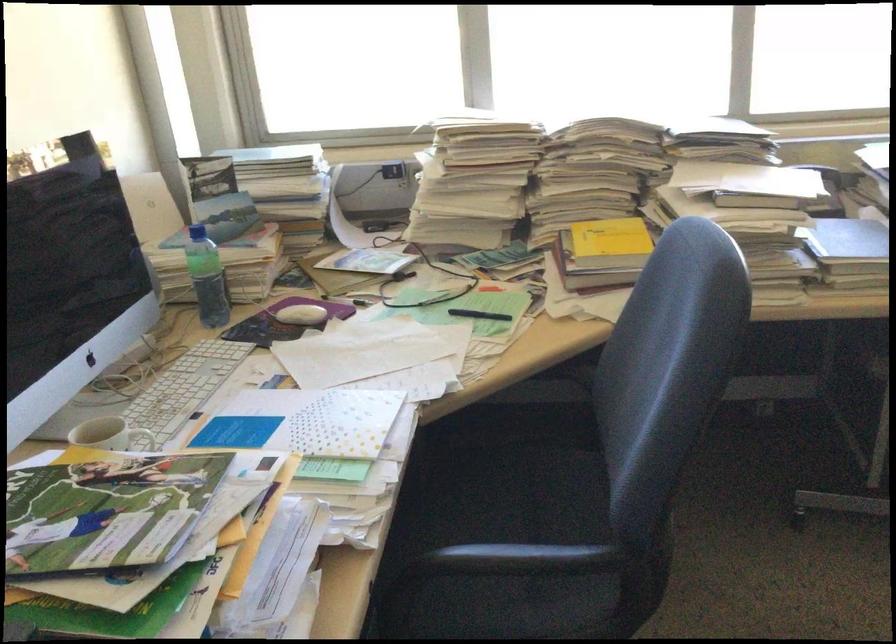
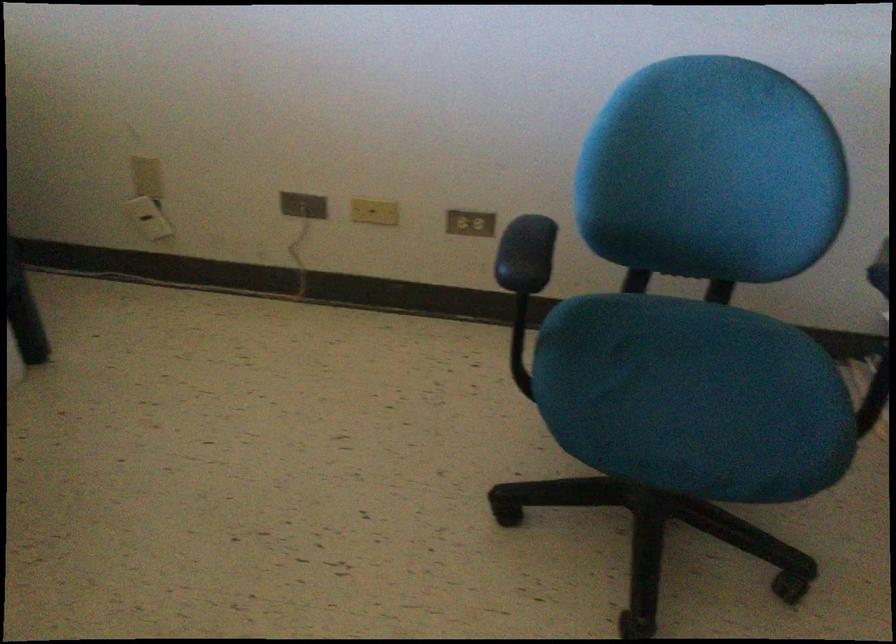
First-person continuous shooting, in which direction is the camera rotating?

The camera rotated toward right-down.